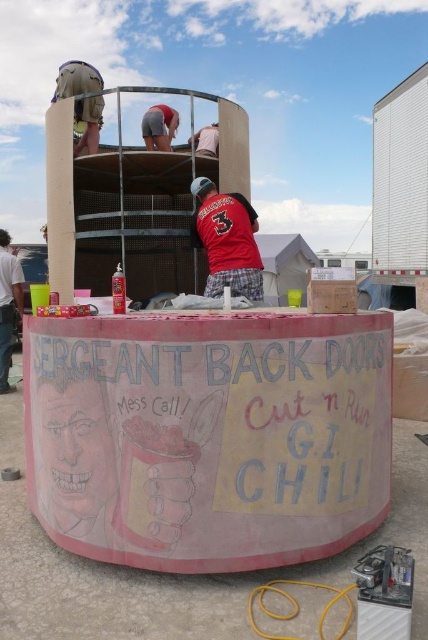
Question: Which of these objects is positioned closest to the pink chalkboard sign at center?

Choices:
 (A) matte red shirt at center
 (B) brushed metal helmet at upper left

Answer: (A)

Question: Can you confirm if pink chalkboard sign at center is positioned above matte red shirt at center?

Choices:
 (A) no
 (B) yes

Answer: (A)

Question: Is pink chalkboard sign at center smaller than matte red shirt at center?

Choices:
 (A) yes
 (B) no

Answer: (B)

Question: Which object is the closest to the brushed metal helmet at upper left?

Choices:
 (A) matte red shirt at center
 (B) pink chalkboard sign at center

Answer: (A)

Question: Can you confirm if pink chalkboard sign at center is bigger than matte red shirt at center?

Choices:
 (A) no
 (B) yes

Answer: (B)

Question: Which object is farther from the camera taking this photo?

Choices:
 (A) pink chalkboard sign at center
 (B) matte red shirt at center

Answer: (B)